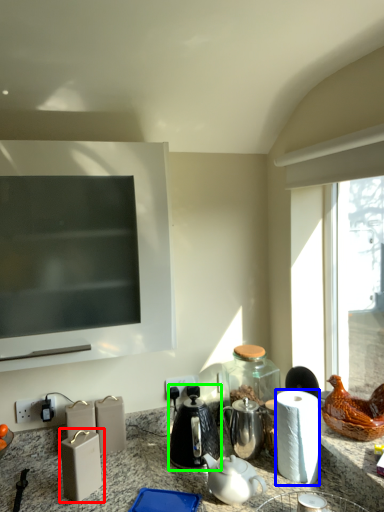
Question: Considering the real-world distances, which object is farthest from appliance (highlighted by a red box)? paper towel (highlighted by a blue box) or coffeepot (highlighted by a green box)?

Choices:
 (A) paper towel
 (B) coffeepot

Answer: (A)